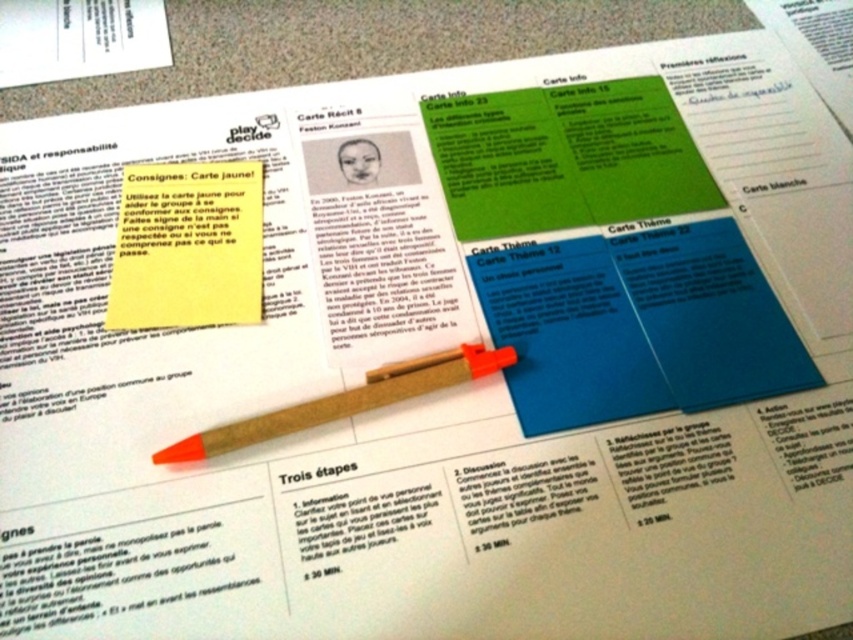
You are organizing a classroom activity and have both the yellow paper at center and the wooden pen at center. Which object would you place in a storage box if you need to prioritize the smaller item?

The wooden pen at center is smaller than the yellow paper at center, so you should place the wooden pen at center in the storage box.

Looking at this image, you are a student working on a worksheet and need to locate the point mentioned in the instructions. According to the document, where is the point labeled as point (187, 246) located?

The point labeled as point (187, 246) corresponds to the yellow paper at center.

You have a yellow paper at center and a wooden pen at center on your desk. Which one is thinner?

The yellow paper at center is thinner than the wooden pen at center.